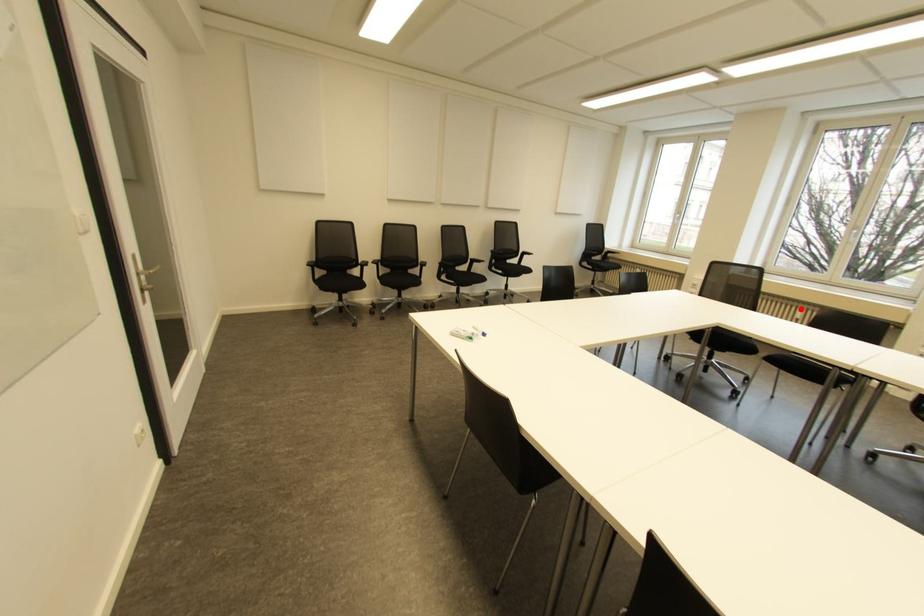
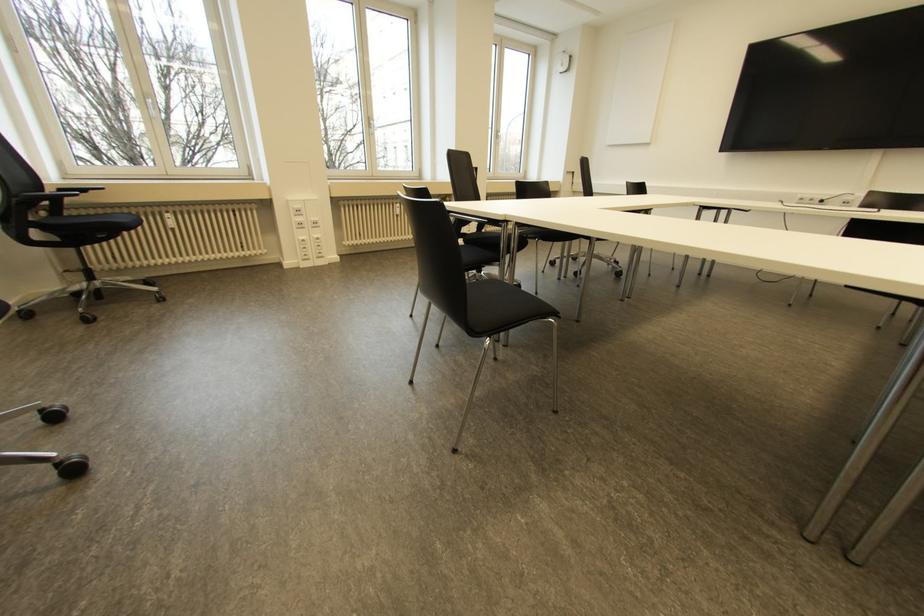
Question: I am providing you with two images of the same scene from different viewpoints. In image1, a red point is highlighted. Considering the same 3D point in image2, which of the following is correct?

Choices:
 (A) It is closer
 (B) It is farther

Answer: (A)